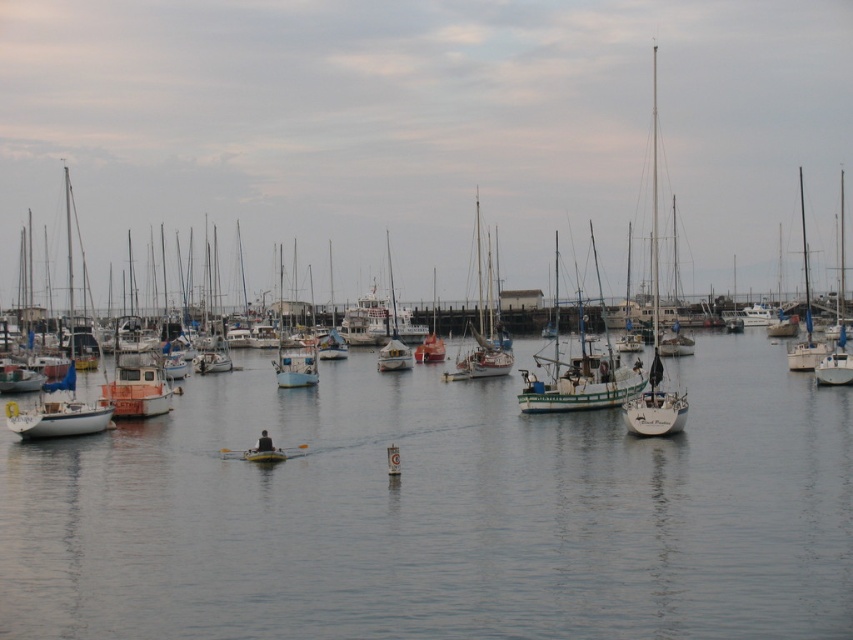
You are standing on the dock and want to take a photo of the clear water at center and the white matte sailboat at right. Which object will appear smaller in your photo?

The clear water at center will appear smaller in the photo because it is thinner than the white matte sailboat at right.

You are standing on the dock and see the clear water at center and the white matte sailboat at right. Which object is closer to the left side of the marina?

The clear water at center is positioned on the left side of white matte sailboat at right, so it is closer to the left side of the marina.